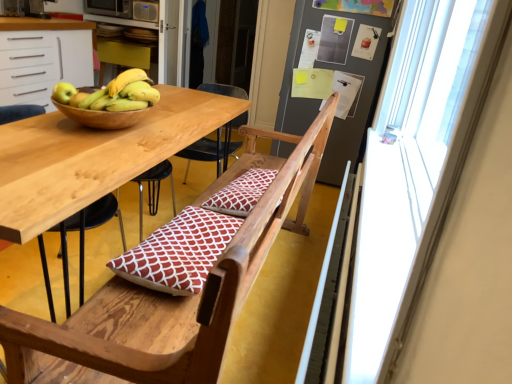
Question: Is green matte apple at upper left inside wooden chair at center?

Choices:
 (A) yes
 (B) no

Answer: (B)

Question: From a real-world perspective, does wooden chair at center stand above green matte apple at upper left?

Choices:
 (A) no
 (B) yes

Answer: (A)

Question: Is wooden chair at center closer to the viewer compared to green matte apple at upper left?

Choices:
 (A) no
 (B) yes

Answer: (B)

Question: Is wooden chair at center behind green matte apple at upper left?

Choices:
 (A) no
 (B) yes

Answer: (A)

Question: Does wooden chair at center have a lesser height compared to green matte apple at upper left?

Choices:
 (A) yes
 (B) no

Answer: (B)

Question: Can you confirm if wooden chair at center is thinner than green matte apple at upper left?

Choices:
 (A) no
 (B) yes

Answer: (A)

Question: Is green matte apple at upper left thinner than wooden chair at center?

Choices:
 (A) yes
 (B) no

Answer: (A)

Question: Does green matte apple at upper left lie behind wooden chair at center?

Choices:
 (A) no
 (B) yes

Answer: (B)

Question: Is green matte apple at upper left facing towards wooden chair at center?

Choices:
 (A) no
 (B) yes

Answer: (A)

Question: Does green matte apple at upper left have a greater width compared to wooden chair at center?

Choices:
 (A) yes
 (B) no

Answer: (B)

Question: From a real-world perspective, does green matte apple at upper left sit lower than wooden chair at center?

Choices:
 (A) yes
 (B) no

Answer: (B)

Question: Are green matte apple at upper left and wooden chair at center beside each other?

Choices:
 (A) yes
 (B) no

Answer: (B)

Question: From the image's perspective, is metallic microwave at upper left located beneath transparent plastic screen door at upper center?

Choices:
 (A) yes
 (B) no

Answer: (B)